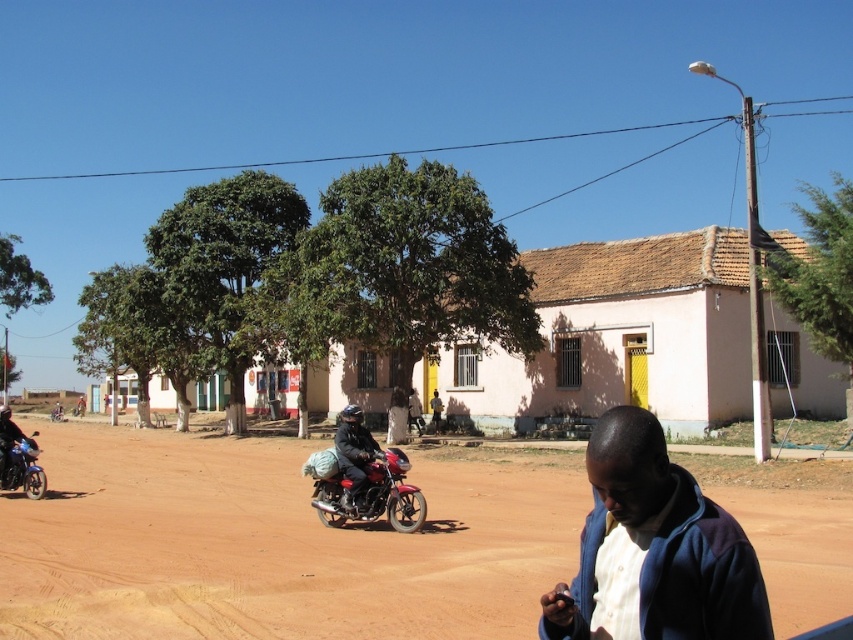
Question: Can you confirm if shiny red motorcycle at center is positioned to the right of metallic blue motorbike at left?

Choices:
 (A) yes
 (B) no

Answer: (A)

Question: Does pink stucco building at center appear over shiny red motorcycle at center?

Choices:
 (A) no
 (B) yes

Answer: (A)

Question: Among these points, which one is nearest to the camera?

Choices:
 (A) (657, 368)
 (B) (619, 616)
 (C) (357, 577)

Answer: (B)

Question: Is shiny red motorcycle at center smaller than metallic blue motorbike at left?

Choices:
 (A) yes
 (B) no

Answer: (A)

Question: Which point appears farthest from the camera in this image?

Choices:
 (A) (392, 496)
 (B) (705, 243)

Answer: (B)

Question: Which is farther from the pink stucco building at center?

Choices:
 (A) brown dirt field at center
 (B) shiny red motorcycle at center

Answer: (B)